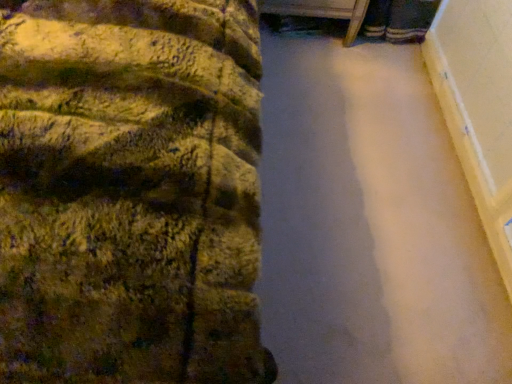
At what (x,y) coordinates should I click in order to perform the action: click on wooden chair at upper center. Please return your answer as a coordinate pair (x, y). The height and width of the screenshot is (384, 512). Looking at the image, I should click on (321, 12).

What do you see at coordinates (321, 12) in the screenshot? This screenshot has height=384, width=512. I see `wooden chair at upper center` at bounding box center [321, 12].

At what (x,y) coordinates should I click in order to perform the action: click on wooden chair at upper center. Please return your answer as a coordinate pair (x, y). Image resolution: width=512 pixels, height=384 pixels. Looking at the image, I should click on (321, 12).